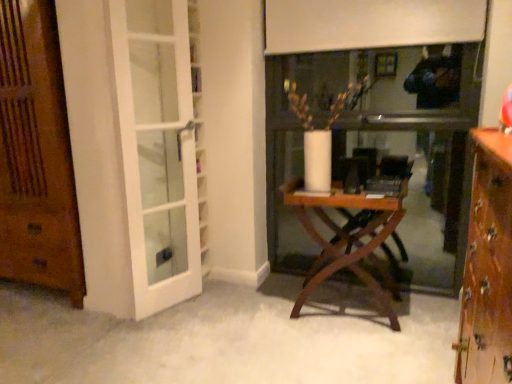
Question: Is wooden cabinet at right at the back of wooden folding table at center?

Choices:
 (A) yes
 (B) no

Answer: (B)

Question: Would you say wooden folding table at center is outside wooden cabinet at right?

Choices:
 (A) no
 (B) yes

Answer: (B)

Question: From the image's perspective, is wooden folding table at center on top of wooden cabinet at right?

Choices:
 (A) no
 (B) yes

Answer: (B)

Question: Is wooden folding table at center touching wooden cabinet at right?

Choices:
 (A) yes
 (B) no

Answer: (B)

Question: Does wooden folding table at center have a larger size compared to wooden cabinet at right?

Choices:
 (A) no
 (B) yes

Answer: (A)

Question: Is wooden folding table at center to the right of wooden cabinet at right from the viewer's perspective?

Choices:
 (A) yes
 (B) no

Answer: (B)

Question: Is the position of wooden folding table at center less distant than that of white glass door at left?

Choices:
 (A) no
 (B) yes

Answer: (A)

Question: Is wooden folding table at center far from white glass door at left?

Choices:
 (A) yes
 (B) no

Answer: (B)

Question: Is wooden folding table at center further to the viewer compared to white glass door at left?

Choices:
 (A) no
 (B) yes

Answer: (B)

Question: Is wooden folding table at center outside of white glass door at left?

Choices:
 (A) yes
 (B) no

Answer: (A)

Question: Can you confirm if wooden folding table at center is smaller than white glass door at left?

Choices:
 (A) yes
 (B) no

Answer: (B)

Question: Considering the relative sizes of wooden folding table at center and white glass door at left in the image provided, is wooden folding table at center taller than white glass door at left?

Choices:
 (A) no
 (B) yes

Answer: (A)

Question: Does white glass door at left come behind wooden door at left?

Choices:
 (A) yes
 (B) no

Answer: (B)